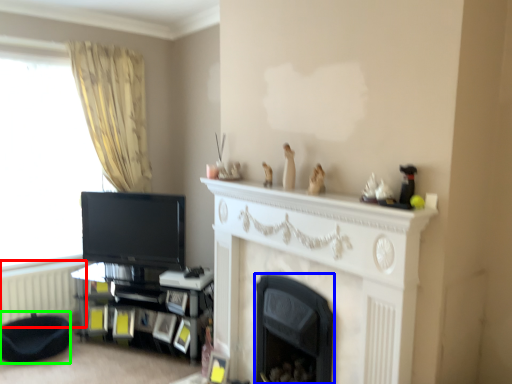
Question: Which is farther away from radiator (highlighted by a red box)? fireplace (highlighted by a blue box) or footrest (highlighted by a green box)?

Choices:
 (A) fireplace
 (B) footrest

Answer: (A)